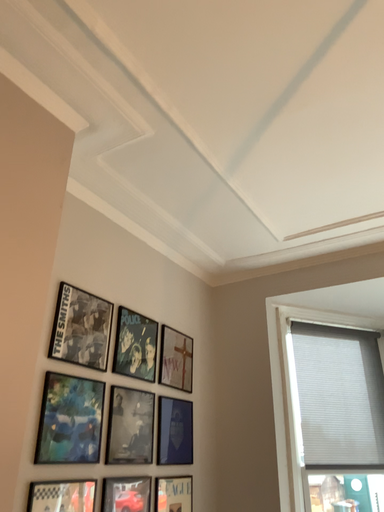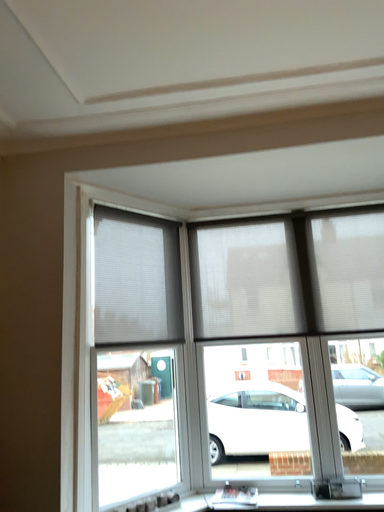
Question: How did the camera likely rotate when shooting the video?

Choices:
 (A) rotated left
 (B) rotated right

Answer: (B)